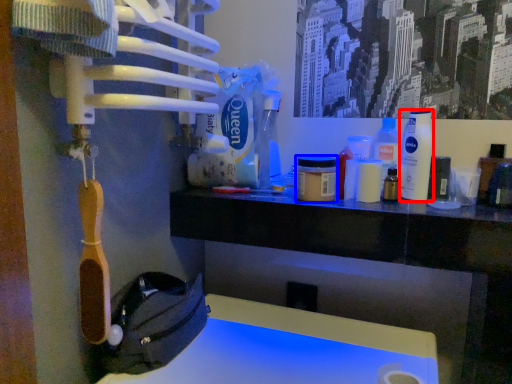
Question: Among these objects, which one is nearest to the camera, bottle (highlighted by a red box) or mouthwash (highlighted by a blue box)?

Choices:
 (A) bottle
 (B) mouthwash

Answer: (B)